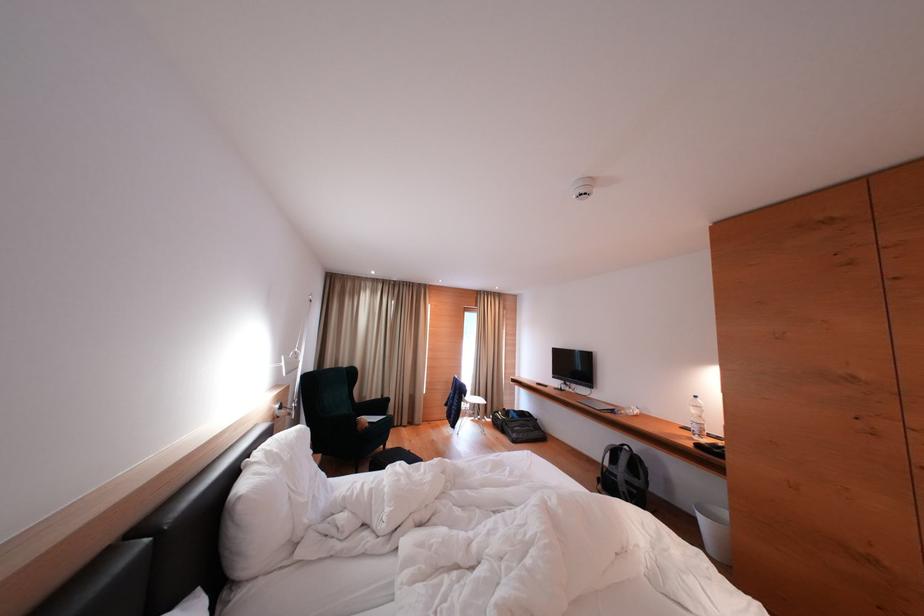
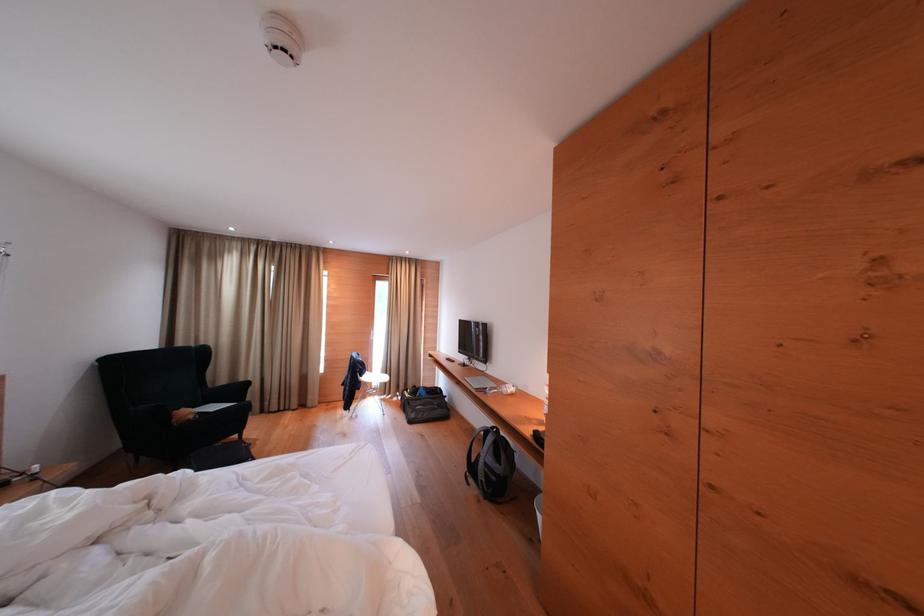
Find the pixel in the second image that matches point (477, 402) in the first image.

(383, 379)